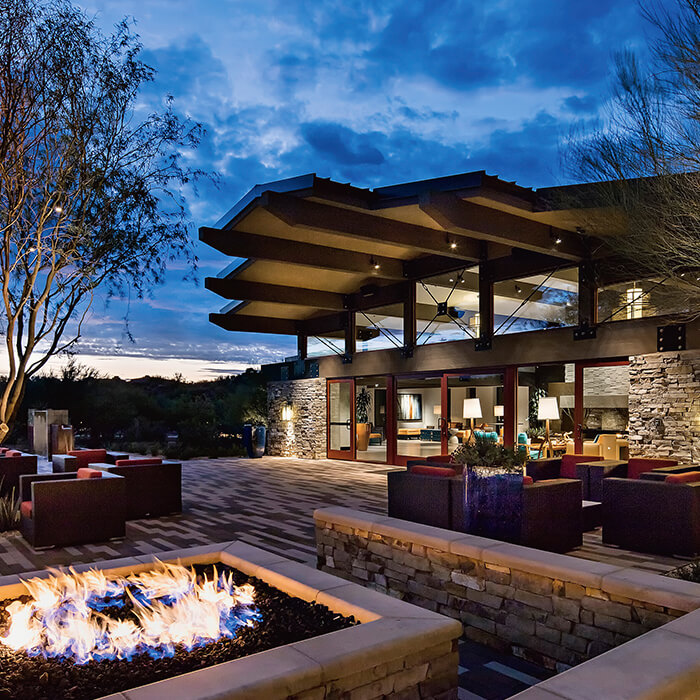
Where is `floor space`? The height and width of the screenshot is (700, 700). floor space is located at coordinates (278, 483).